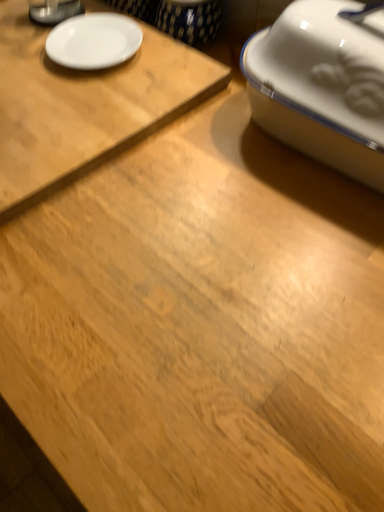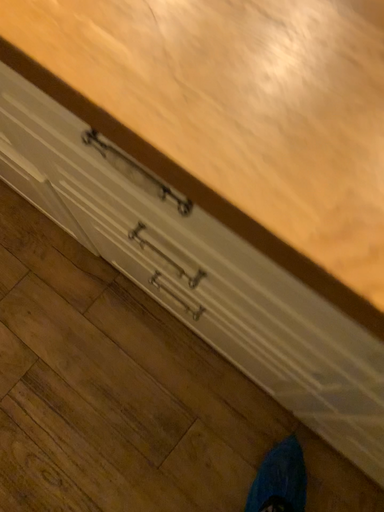
Question: How did the camera likely rotate when shooting the video?

Choices:
 (A) rotated downward
 (B) rotated upward

Answer: (A)